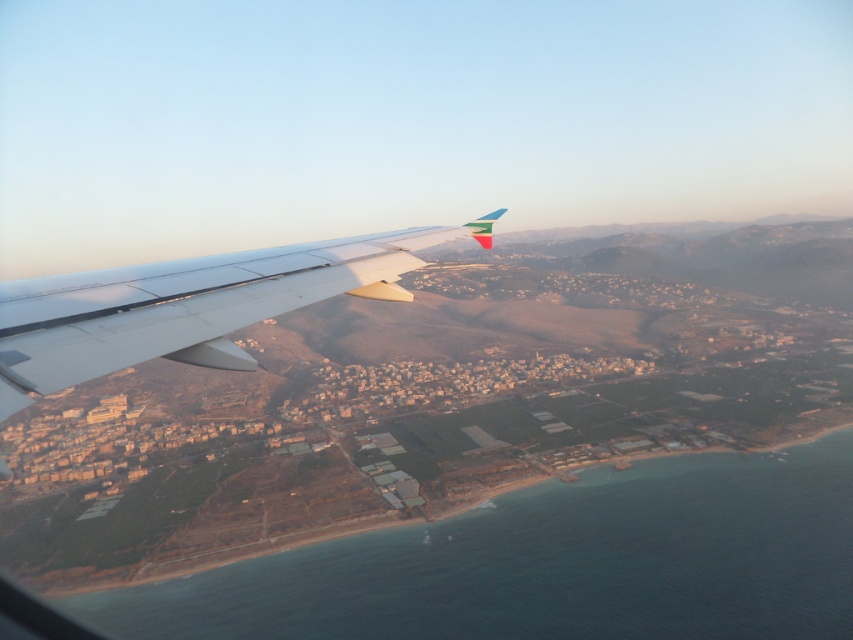
You are a pilot looking at the view from the airplane window. You notice two points marked in the scene. Which of the two points, point [351,536] or point [379,248], is farther away from the airplane?

Point [351,536] is farther away from the airplane because it is positioned behind point [379,248].

You are a pilot looking at the view from the airplane window. You see the blue water at lower left. Can you determine its exact coordinates in the image?

The blue water at lower left is located at coordinates point (553, 563).